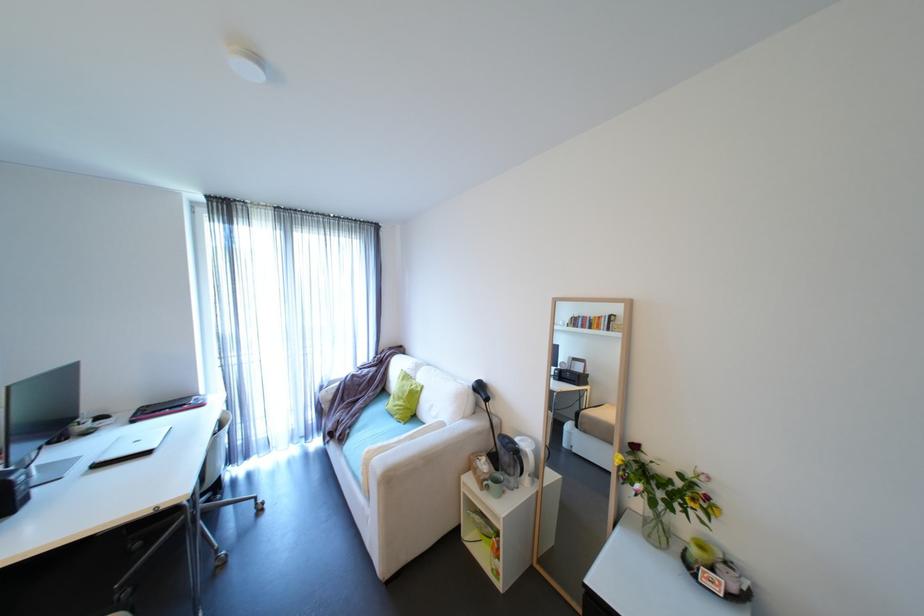
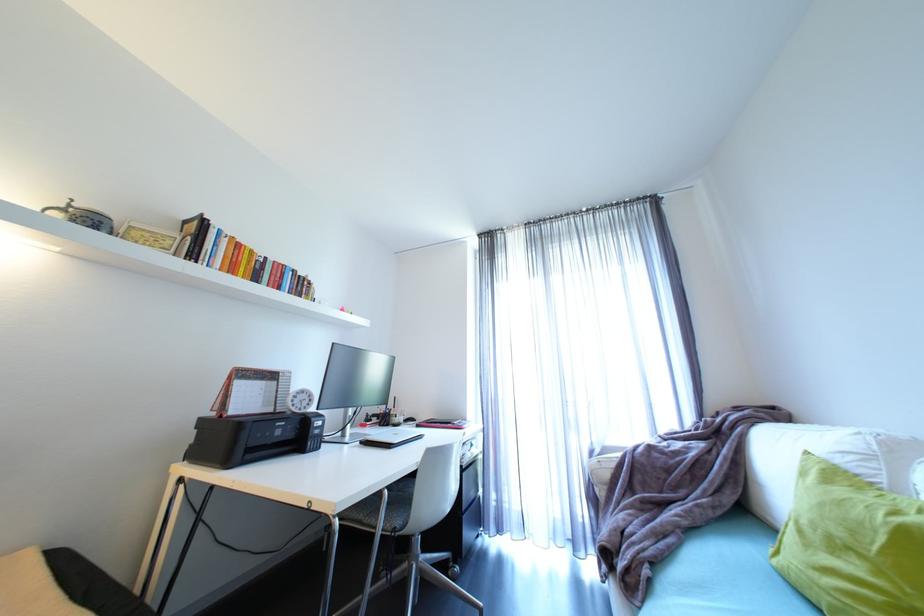
Locate, in the second image, the point that corresponds to pixel 191 405 in the first image.

(457, 424)